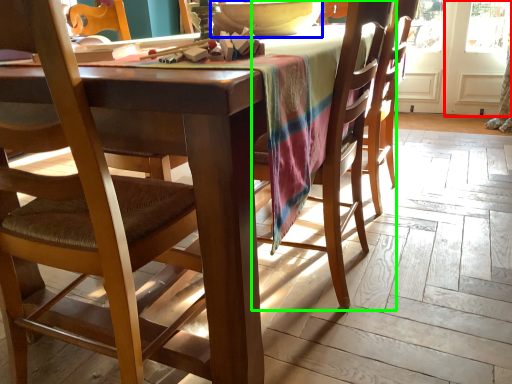
Question: Estimate the real-world distances between objects in this image. Which object is closer to screen door (highlighted by a red box), bowl (highlighted by a blue box) or chair (highlighted by a green box)?

Choices:
 (A) bowl
 (B) chair

Answer: (B)